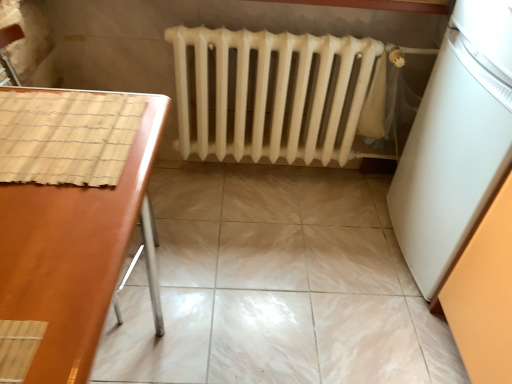
Locate an element on the screen. free space above brown glossy table at left (from a real-world perspective) is located at coordinates (50, 167).